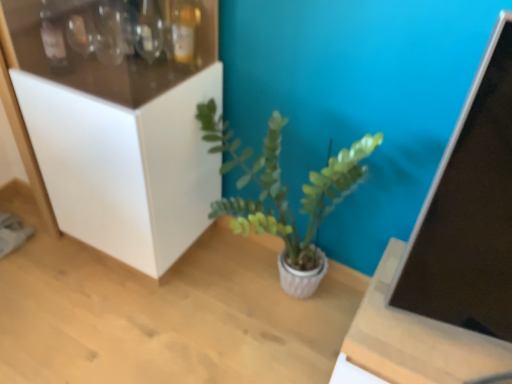
What do you see at coordinates (285, 195) in the screenshot? I see `green matte plant at center` at bounding box center [285, 195].

The height and width of the screenshot is (384, 512). In order to click on white matte cabinet at left in this screenshot , I will do `click(119, 120)`.

Where is `green matte plant at center`? The width and height of the screenshot is (512, 384). green matte plant at center is located at coordinates (285, 195).

This screenshot has width=512, height=384. I want to click on table beneath the white matte cabinet at left (from a real-world perspective), so pyautogui.click(x=412, y=341).

Which of these two, wooden table at center or white matte cabinet at left, is wider?

wooden table at center is wider.

Is point (416, 373) closer or farther from the camera than point (141, 112)?

Point (416, 373) appears to be closer to the viewer than point (141, 112).

Does white matte cabinet at left have a greater width compared to wooden table at center?

No, white matte cabinet at left is not wider than wooden table at center.

Who is smaller, white matte cabinet at left or wooden table at center?

With smaller size is wooden table at center.

From a real-world perspective, which object rests below the other?

In real-world perspective, wooden table at center is lower.

Is green matte plant at center surrounding wooden table at center?

That's incorrect, wooden table at center is not inside green matte plant at center.

Does point (311, 245) appear closer or farther from the camera than point (345, 368)?

Point (311, 245).

Based on their sizes in the image, would you say green matte plant at center is bigger or smaller than wooden table at center?

In the image, green matte plant at center appears to be larger than wooden table at center.

From the picture: From the image's perspective, relative to wooden table at center, is green matte plant at center above or below?

Clearly, from the image's perspective, green matte plant at center is above wooden table at center.

From their relative heights in the image, would you say wooden table at center is taller or shorter than green matte plant at center?

wooden table at center is shorter than green matte plant at center.

From a real-world perspective, which is physically below, wooden table at center or green matte plant at center?

wooden table at center is physically lower.

Is wooden table at center facing away from green matte plant at center?

No.

Is wooden table at center wider than green matte plant at center?

Correct, the width of wooden table at center exceeds that of green matte plant at center.

Can you confirm if white matte cabinet at left is wider than green matte plant at center?

Yes, white matte cabinet at left is wider than green matte plant at center.

Which is nearer, (96, 186) or (220, 139)?

Point (96, 186)

Where is `cabinetry above the green matte plant at center (from a real-world perspective)`? Image resolution: width=512 pixels, height=384 pixels. cabinetry above the green matte plant at center (from a real-world perspective) is located at coordinates (119, 120).

Between white matte cabinet at left and green matte plant at center, which one has larger size?

white matte cabinet at left is bigger.

Is point (212, 102) positioned before point (195, 102)?

No, it is behind (195, 102).

Is green matte plant at center bigger or smaller than white matte cabinet at left?

In the image, green matte plant at center appears to be smaller than white matte cabinet at left.

Considering the relative positions of green matte plant at center and white matte cabinet at left in the image provided, is green matte plant at center to the left of white matte cabinet at left from the viewer's perspective?

No.

What are the coordinates of `table in front of the white matte cabinet at left` in the screenshot? It's located at (412, 341).

This screenshot has width=512, height=384. What are the coordinates of `table located below the white matte cabinet at left (from the image's perspective)` in the screenshot? It's located at (412, 341).

Based on their spatial positions, is white matte cabinet at left or green matte plant at center closer to wooden table at center?

green matte plant at center lies closer to wooden table at center than the other object.

When comparing their distances from white matte cabinet at left, does green matte plant at center or wooden table at center seem closer?

green matte plant at center is positioned closer to the anchor white matte cabinet at left.

Looking at the image, which one is located further to green matte plant at center, white matte cabinet at left or wooden table at center?

Based on the image, wooden table at center appears to be further to green matte plant at center.

Which object lies further to the anchor point green matte plant at center, wooden table at center or white matte cabinet at left?

wooden table at center is further to green matte plant at center.

From the image, which object appears to be nearer to white matte cabinet at left, wooden table at center or green matte plant at center?

Based on the image, green matte plant at center appears to be nearer to white matte cabinet at left.

Estimate the real-world distances between objects in this image. Which object is further from wooden table at center, green matte plant at center or white matte cabinet at left?

white matte cabinet at left is further to wooden table at center.

I want to click on houseplant between white matte cabinet at left and wooden table at center in the horizontal direction, so click(x=285, y=195).